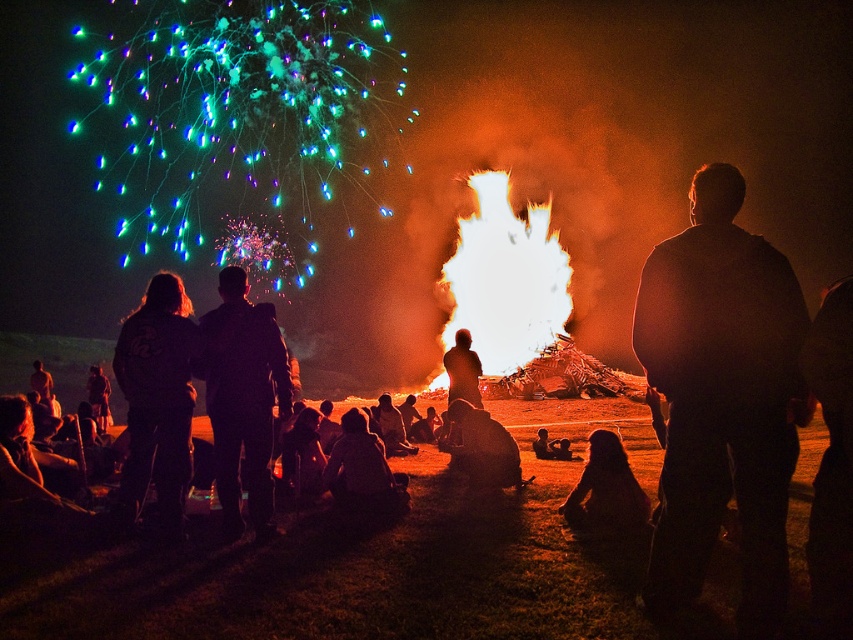
In the scene shown: Can you confirm if black matte jacket at center is bigger than black fabric jacket at left?

Yes.

Between black matte jacket at center and black fabric jacket at left, which one has more height?

black matte jacket at center is taller.

Is point (281, 397) positioned in front of point (175, 515)?

No, it is behind (175, 515).

Identify the location of black matte jacket at center. (242, 397).

Locate an element on the screen. The width and height of the screenshot is (853, 640). black matte jacket at center is located at coordinates (242, 397).

Can you confirm if black matte jacket at center is positioned to the right of silhouette fabric at center?

In fact, black matte jacket at center is to the left of silhouette fabric at center.

Identify the location of black matte jacket at center. (242, 397).

Which is more to the left, black matte jacket at right or silhouette fabric at center?

silhouette fabric at center

Which of these two, black matte jacket at right or silhouette fabric at center, stands taller?

black matte jacket at right

Between point (666, 445) and point (338, 502), which one is positioned behind?

The point (338, 502) is behind.

What are the coordinates of `black matte jacket at right` in the screenshot? It's located at (722, 400).